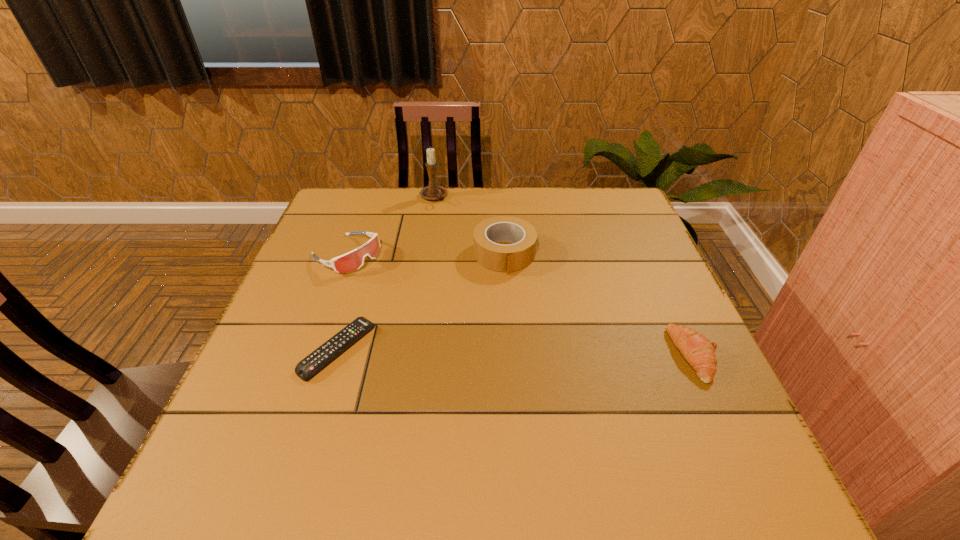
What are the coordinates of `remote control` in the screenshot? It's located at (305, 369).

This screenshot has width=960, height=540. Identify the location of crescent roll. (699, 352).

The image size is (960, 540). Identify the location of the fourth tallest object. (699, 352).

Locate an element on the screen. duct tape is located at coordinates [503, 258].

This screenshot has height=540, width=960. I want to click on the farthest object, so click(433, 192).

What are the coordinates of `candle holder` in the screenshot? It's located at (433, 192).

Where is `goggles`? Image resolution: width=960 pixels, height=540 pixels. goggles is located at coordinates (353, 260).

Image resolution: width=960 pixels, height=540 pixels. In order to click on free point located 0.050m on the front of the remote control in this screenshot , I will do `click(321, 404)`.

At what (x,y) coordinates should I click in order to perform the action: click on vacant space located 0.180m on the back of the crescent roll. Please return your answer as a coordinate pair (x, y). Looking at the image, I should click on (659, 276).

This screenshot has height=540, width=960. What are the coordinates of `vacant space located at the edge of the second object from right to left` in the screenshot? It's located at (531, 358).